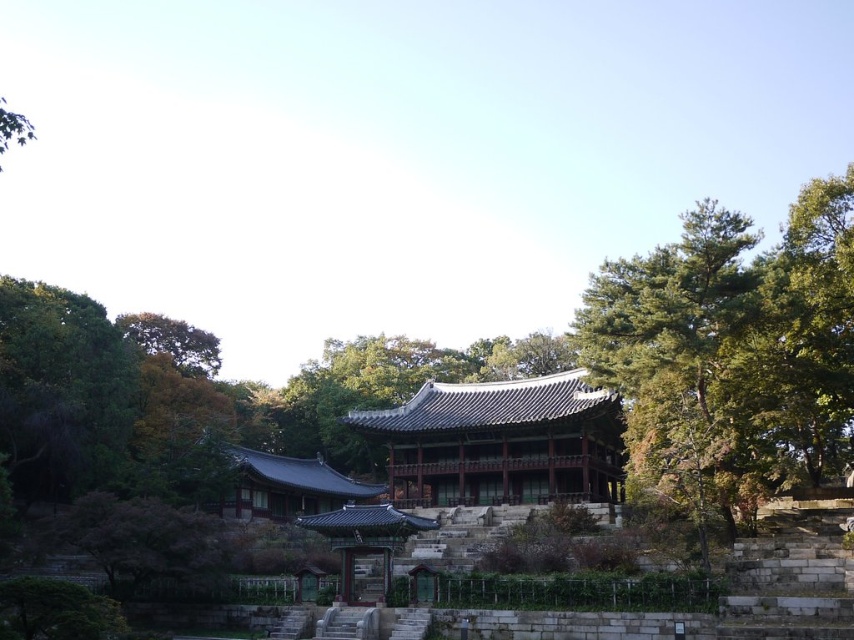
Can you confirm if green textured tree at right is positioned above shiny dark brown wooden temple at center?

Yes.

Between green textured tree at right and shiny dark brown wooden temple at center, which one appears on the right side from the viewer's perspective?

green textured tree at right is more to the right.

Describe the element at coordinates (676, 358) in the screenshot. I see `green textured tree at right` at that location.

You are a GUI agent. You are given a task and a screenshot of the screen. Output one action in this format:
    pyautogui.click(x=<x>, y=<y>)
    Task: Click on the green textured tree at right
    This screenshot has height=640, width=854.
    Given the screenshot: What is the action you would take?
    pyautogui.click(x=676, y=358)

Can you confirm if shiny dark brown wooden temple at center is smaller than green leafy tree at upper left?

Yes.

Is shiny dark brown wooden temple at center bigger than green leafy tree at upper left?

No.

Is point (553, 442) positioned in front of point (7, 148)?

Yes, point (553, 442) is closer to viewer.

At what (x,y) coordinates should I click in order to perform the action: click on shiny dark brown wooden temple at center. Please return your answer as a coordinate pair (x, y). The width and height of the screenshot is (854, 640). Looking at the image, I should click on (500, 442).

From the picture: Can you confirm if green textured tree at right is shorter than green leafy tree at upper left?

Yes, green textured tree at right is shorter than green leafy tree at upper left.

Consider the image. Can you confirm if green textured tree at right is positioned to the right of green leafy tree at upper left?

Correct, you'll find green textured tree at right to the right of green leafy tree at upper left.

Describe the element at coordinates (676, 358) in the screenshot. The width and height of the screenshot is (854, 640). I see `green textured tree at right` at that location.

The image size is (854, 640). In order to click on green textured tree at right in this screenshot , I will do `click(676, 358)`.